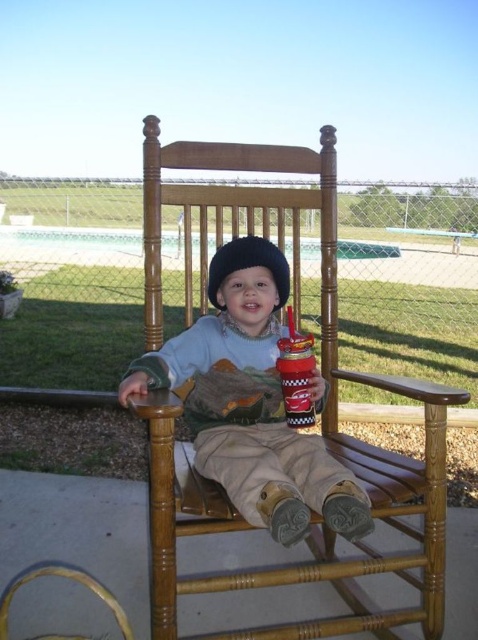
Is wooden rocking chair at center thinner than fuzzy black hat at center?

No.

Which is above, wooden rocking chair at center or fuzzy black hat at center?

fuzzy black hat at center is above.

Identify the location of wooden rocking chair at center. The height and width of the screenshot is (640, 478). (321, 416).

Can you confirm if matte plastic toddler at center is bigger than fuzzy black hat at center?

Yes.

From the picture: Can you confirm if matte plastic toddler at center is thinner than fuzzy black hat at center?

No.

The height and width of the screenshot is (640, 478). What do you see at coordinates (250, 403) in the screenshot?
I see `matte plastic toddler at center` at bounding box center [250, 403].

The image size is (478, 640). Identify the location of matte plastic toddler at center. (250, 403).

Does wooden rocking chair at center appear on the right side of matte plastic toddler at center?

Correct, you'll find wooden rocking chair at center to the right of matte plastic toddler at center.

Does point (201, 188) come in front of point (226, 364)?

No, (201, 188) is further to viewer.

Which is in front, point (335, 211) or point (166, 352)?

Point (166, 352)

At what (x,y) coordinates should I click in order to perform the action: click on wooden rocking chair at center. Please return your answer as a coordinate pair (x, y). The height and width of the screenshot is (640, 478). Looking at the image, I should click on (321, 416).